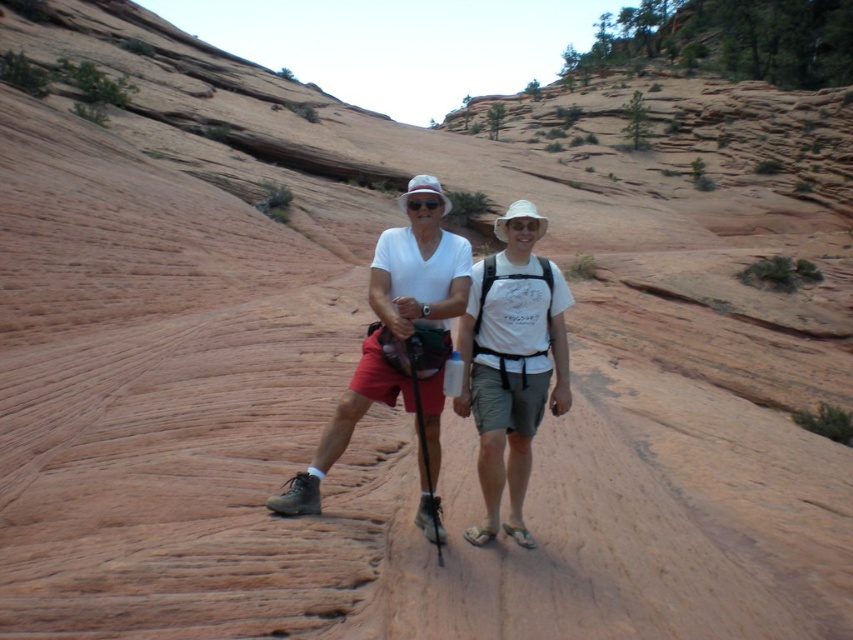
Can you confirm if matte white t-shirt at center is bigger than white cotton t-shirt at center?

Yes, matte white t-shirt at center is bigger than white cotton t-shirt at center.

Locate an element on the screen. This screenshot has height=640, width=853. matte white t-shirt at center is located at coordinates (399, 346).